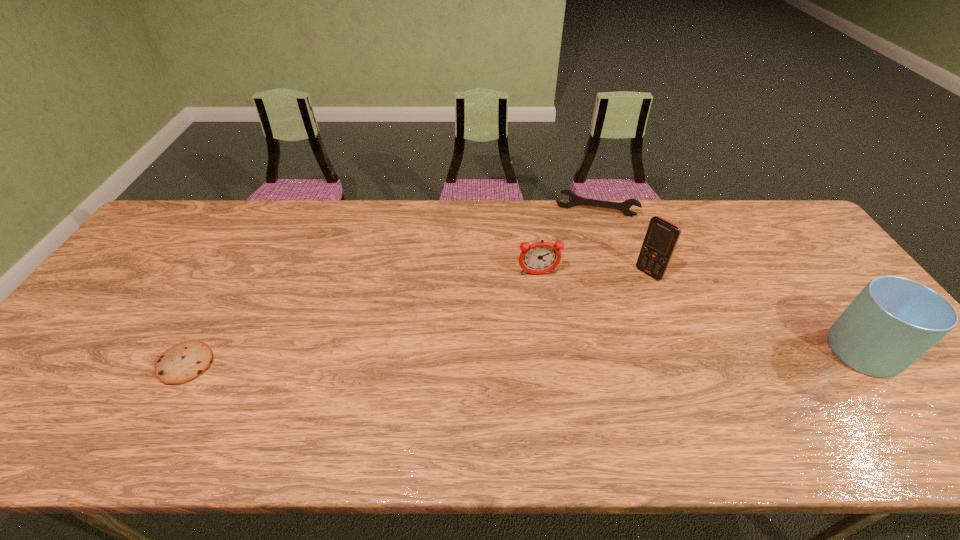
Find the location of a particular element. The width and height of the screenshot is (960, 540). vacant space located 0.400m on the front-facing side of the second object from left to right is located at coordinates (566, 403).

The height and width of the screenshot is (540, 960). I want to click on blank space located 0.190m on the front-facing side of the second object from left to right, so click(551, 330).

Image resolution: width=960 pixels, height=540 pixels. In order to click on blank area located 0.130m on the front-facing side of the second object from left to right in this screenshot , I will do `click(547, 313)`.

At what (x,y) coordinates should I click in order to perform the action: click on free space located 0.180m on the open ends of the second shortest object. Please return your answer as a coordinate pair (x, y). Looking at the image, I should click on (586, 253).

Find the location of a particular element. Image resolution: width=960 pixels, height=540 pixels. free location located on the open ends of the second shortest object is located at coordinates (584, 282).

This screenshot has height=540, width=960. I want to click on vacant space situated on the open ends of the second shortest object, so click(587, 245).

Locate an element on the screen. free region located 0.110m on the screen of the cellular telephone is located at coordinates (620, 299).

In order to click on free space located on the screen of the cellular telephone in this screenshot , I will do `click(550, 357)`.

Identify the location of vacant space located 0.240m on the screen of the cellular telephone. The height and width of the screenshot is (540, 960). (590, 323).

Find the location of a particular element. This screenshot has width=960, height=540. object present at the far edge is located at coordinates (575, 200).